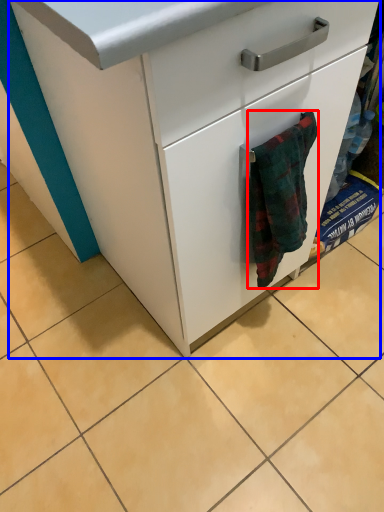
Question: Which point is closer to the camera, bath towel (highlighted by a red box) or chest of drawers (highlighted by a blue box)?

Choices:
 (A) bath towel
 (B) chest of drawers

Answer: (B)